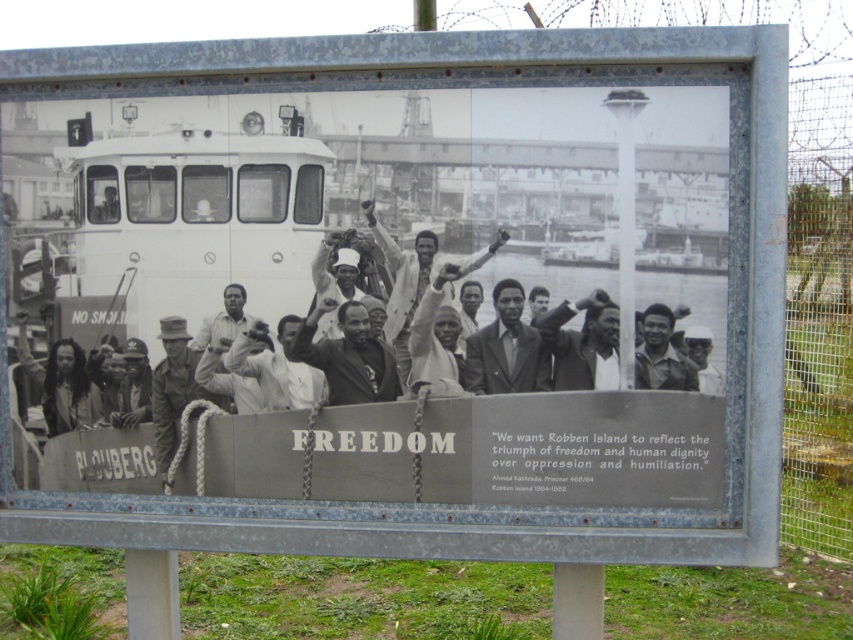
Question: Which point is closer to the camera?

Choices:
 (A) camouflage fabric soldier at center
 (B) light gray suit at center

Answer: (B)

Question: Can you confirm if dark gray suit at center is wider than light gray suit at center?

Choices:
 (A) yes
 (B) no

Answer: (B)

Question: Observing the image, what is the correct spatial positioning of dark skin smooth face at center in reference to smooth skin man at center?

Choices:
 (A) below
 (B) above

Answer: (A)

Question: Which object is closer to the camera taking this photo?

Choices:
 (A) matte black shirt at center
 (B) light beige suit at center
 (C) light gray suit at center

Answer: (A)

Question: Based on their relative distances, which object is farther from the light beige suit at center?

Choices:
 (A) smooth skin face at center
 (B) smooth skin man at center

Answer: (A)

Question: Can you confirm if matte black shirt at center is thinner than smooth skin man at center?

Choices:
 (A) yes
 (B) no

Answer: (B)